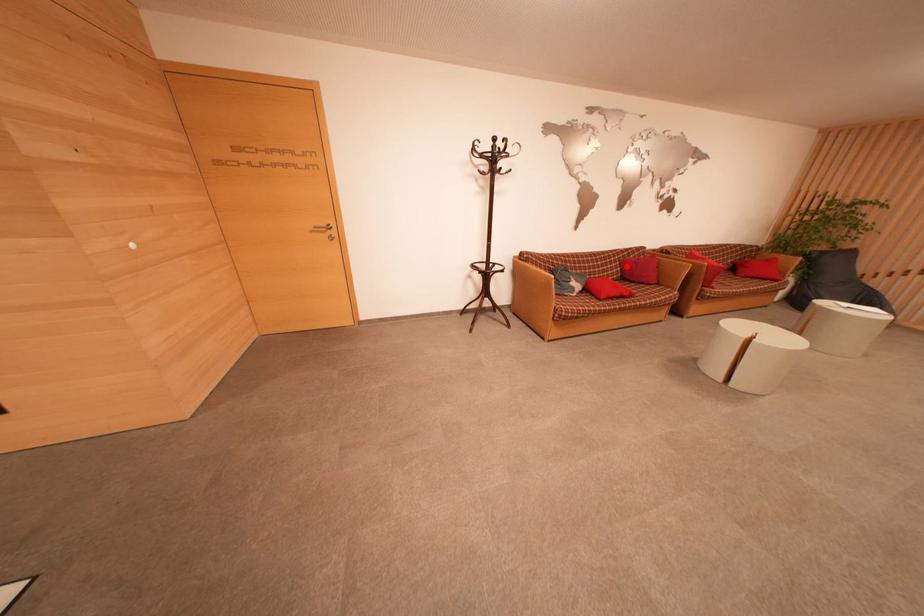
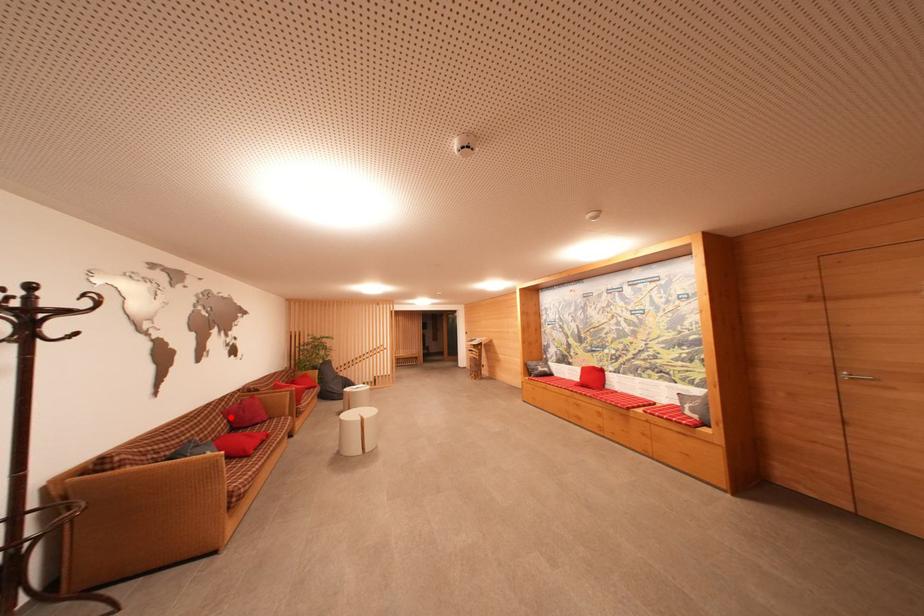
I am providing you with two images of the same scene from different viewpoints. A red point is marked on the first image and another point is marked on the second image. Is the red point in image1 aligned with the point shown in image2?

Yes